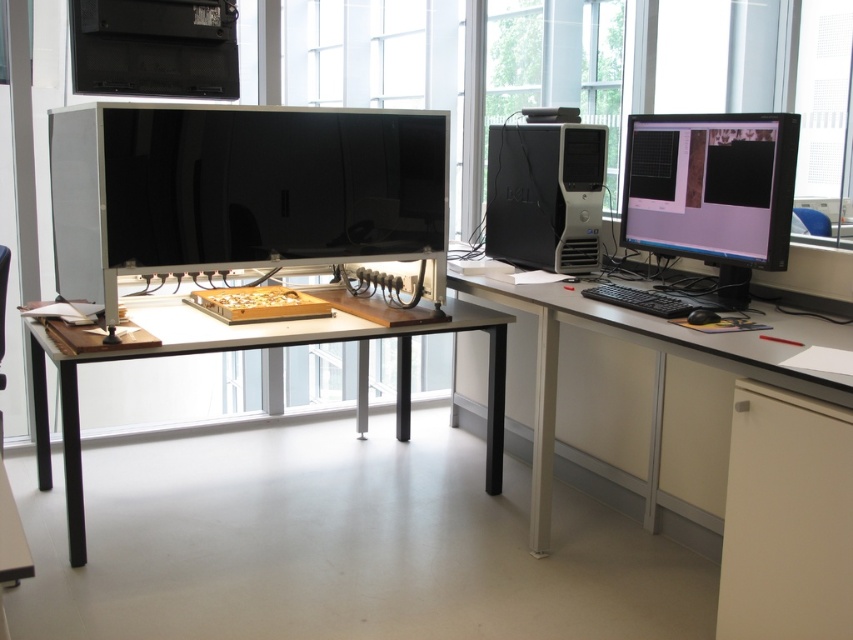
Question: Which of the following is the closest to the observer?

Choices:
 (A) matte black monitor at center
 (B) black plastic computer tower at center-right

Answer: (A)

Question: Which point appears farthest from the camera in this image?

Choices:
 (A) (296, 330)
 (B) (758, 486)
 (C) (239, 128)

Answer: (A)

Question: Does white glossy table at center have a larger size compared to matte black monitor at right?

Choices:
 (A) yes
 (B) no

Answer: (A)

Question: Estimate the real-world distances between objects in this image. Which object is closer to the black plastic computer tower at center-right?

Choices:
 (A) white matte desk at center
 (B) matte black monitor at right
 (C) matte black monitor at center
 (D) black matte keyboard at right

Answer: (B)

Question: Observing the image, what is the correct spatial positioning of white matte desk at center in reference to black plastic computer tower at center-right?

Choices:
 (A) right
 (B) left

Answer: (B)

Question: Observing the image, what is the correct spatial positioning of black plastic computer tower at center-right in reference to black matte keyboard at right?

Choices:
 (A) below
 (B) above

Answer: (B)